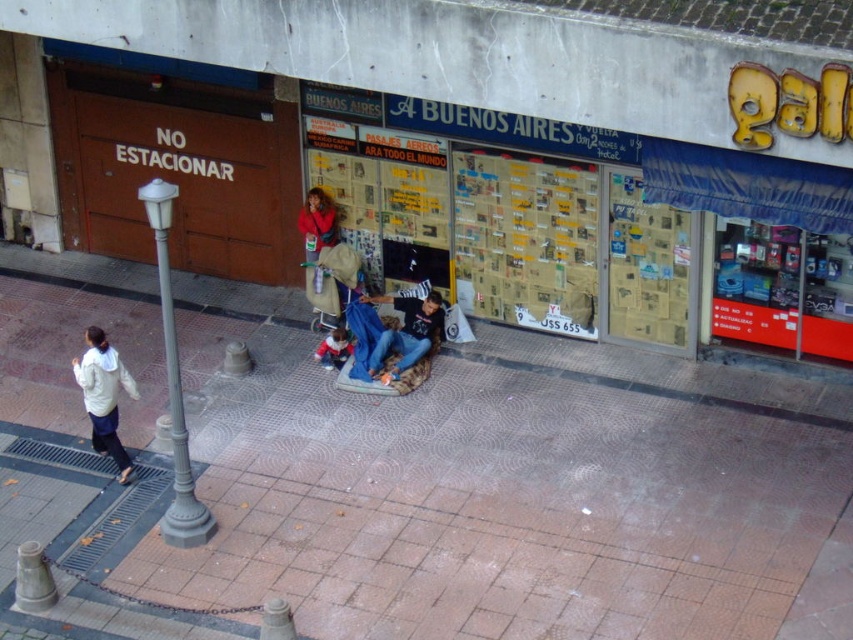
You are a customer entering the store and see the white matte jacket at lower left and the denim jeans at center. Which item would you need to move aside first to reach the travel brochure behind them?

The white matte jacket at lower left is bigger than the denim jeans at center, so you would need to move the white matte jacket at lower left first to reach the travel brochure behind them.

You are standing on the brown brick pavement at center and looking down at the denim jeans at center. Which object is larger in size?

The brown brick pavement at center is bigger than the denim jeans at center.

You are a customer entering the store and see the white matte jacket at lower left and the denim jeans at center. Which item is closer to the entrance?

The white matte jacket at lower left is located below the denim jeans at center, so the denim jeans at center is closer to the entrance since it is higher up.